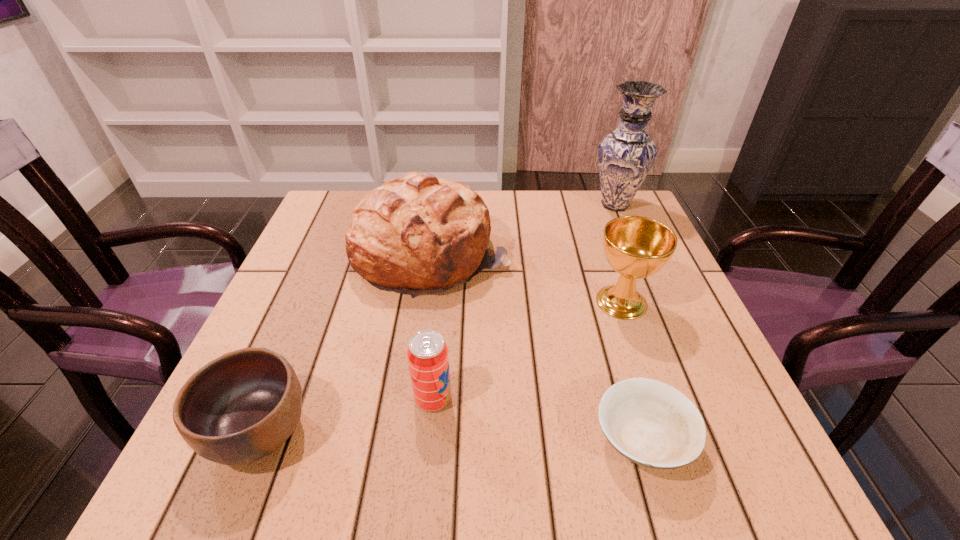
Find the location of `vase`. vase is located at coordinates (625, 156).

Find the location of a particular element. The height and width of the screenshot is (540, 960). bread is located at coordinates (415, 234).

I want to click on chalice, so click(x=636, y=247).

Locate an element on the screen. Image resolution: width=960 pixels, height=540 pixels. soda can is located at coordinates (427, 353).

You are a GUI agent. You are given a task and a screenshot of the screen. Output one action in this format:
    pyautogui.click(x=<x>, y=<y>)
    Task: Click on the left bowl
    
    Given the screenshot: What is the action you would take?
    pyautogui.click(x=242, y=406)

Locate an element on the screen. This screenshot has width=960, height=540. the taller bowl is located at coordinates (242, 406).

Locate an element on the screen. The height and width of the screenshot is (540, 960). the shortest object is located at coordinates (651, 423).

I want to click on the shorter bowl, so point(651,423).

You are a GUI agent. You are given a task and a screenshot of the screen. Output one action in this format:
    pyautogui.click(x=<x>, y=<y>)
    Task: Click on the vacant space located on the front of the tallest object
    Image resolution: width=960 pixels, height=540 pixels.
    Given the screenshot: What is the action you would take?
    pyautogui.click(x=669, y=330)

Identify the location of free region located on the front of the bread. (420, 349).